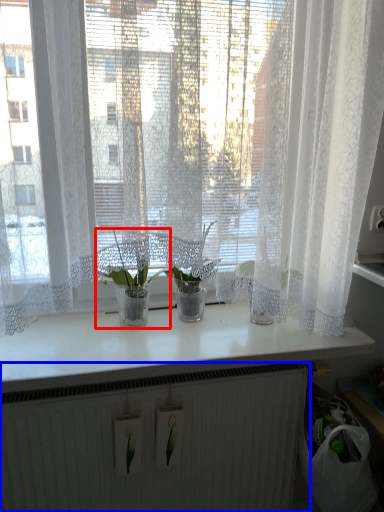
Question: Which object appears farthest to the camera in this image, houseplant (highlighted by a red box) or radiator (highlighted by a blue box)?

Choices:
 (A) houseplant
 (B) radiator

Answer: (A)